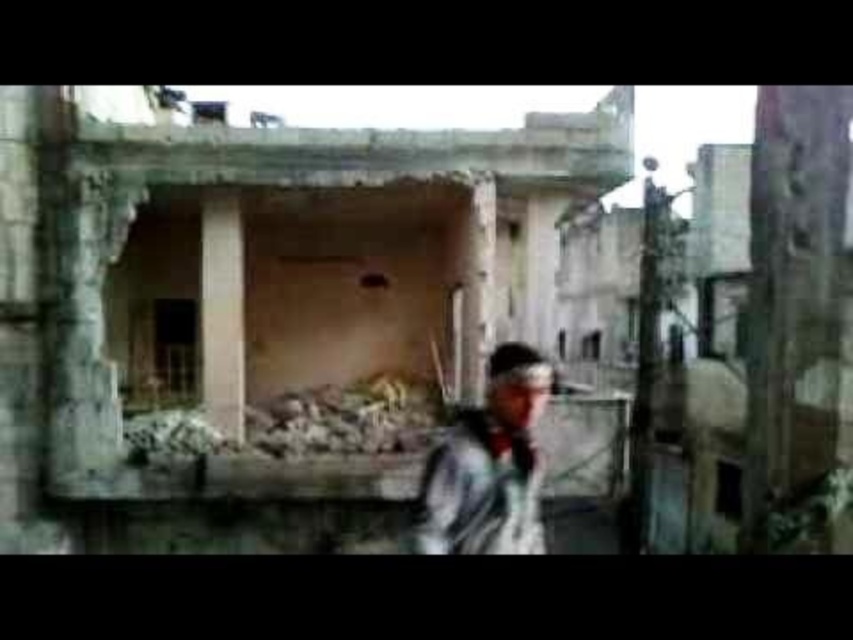
Based on the scene description, which object is taller between the concrete rubble at center and the brown concrete pillar at center?

The concrete rubble at center is much taller than the brown concrete pillar at center.

Based on the scene description, which object is taller between the rusty concrete rubble at center and the brown concrete pillar at center?

The brown concrete pillar at center is taller than the rusty concrete rubble at center according to the description.

Based on the scene description, which object is positioned higher in the image, the concrete rubble at center or the brown concrete pillar at center?

The concrete rubble at center is located above the brown concrete pillar at center, so it is positioned higher.